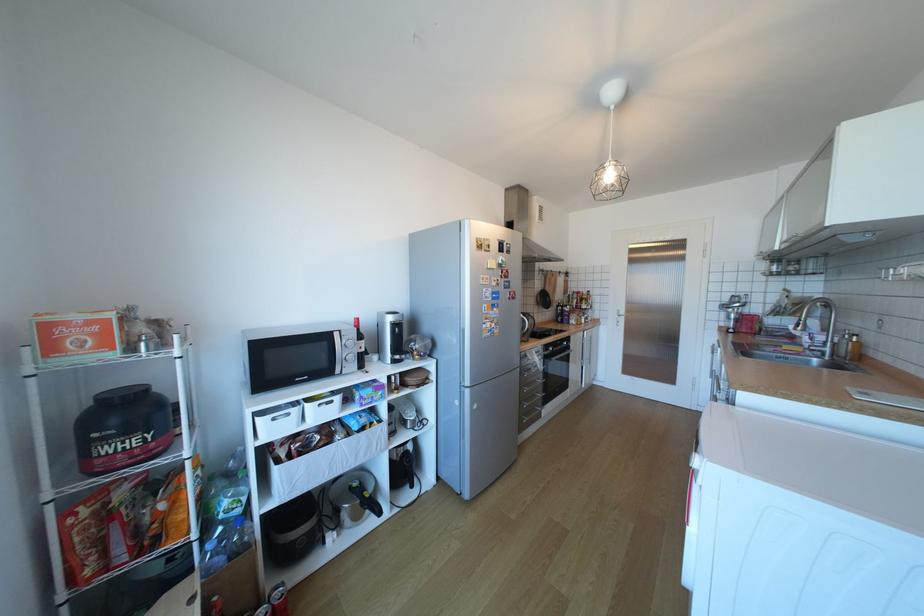
Find where to pull the left fabric bin handle. Please return your answer as a coordinate pair (x, y).

(276, 419)